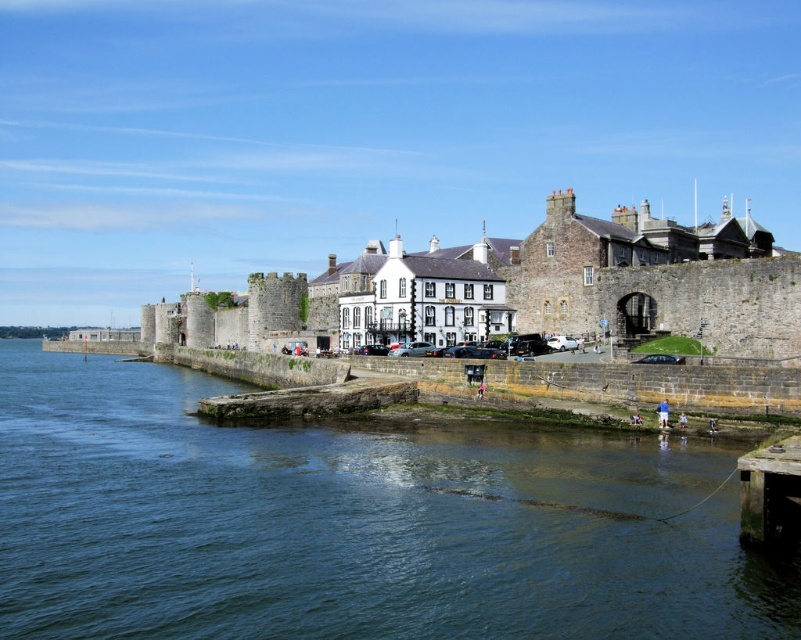
Does point (115, 435) lie in front of point (745, 518)?

No, it is not.

Does point (365, 625) come closer to viewer compared to point (745, 464)?

Yes, point (365, 625) is closer to viewer.

Find the location of a particular element. green stone river at center is located at coordinates (353, 522).